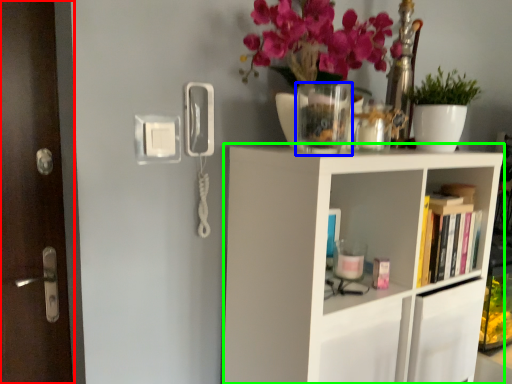
Question: Which object is the farthest from door (highlighted by a red box)? Choose among these: glass vase (highlighted by a blue box) or shelf (highlighted by a green box).

Choices:
 (A) glass vase
 (B) shelf

Answer: (B)